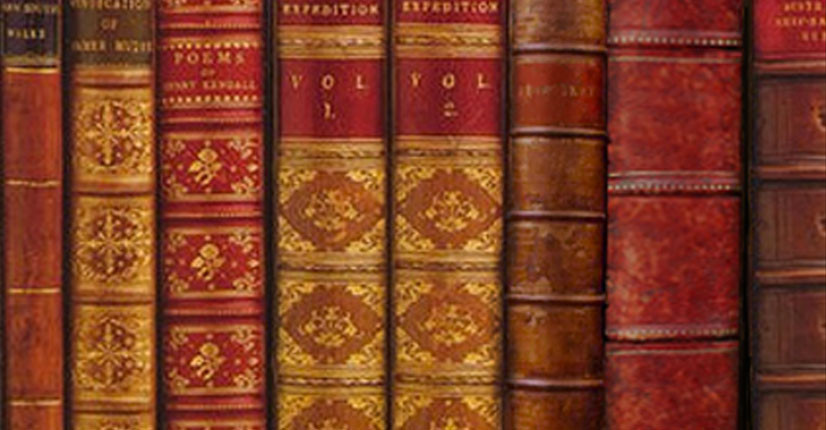
The width and height of the screenshot is (826, 430). I want to click on books, so click(34, 75), click(136, 99), click(192, 115), click(290, 140), click(457, 143), click(535, 143), click(675, 147), click(772, 153).